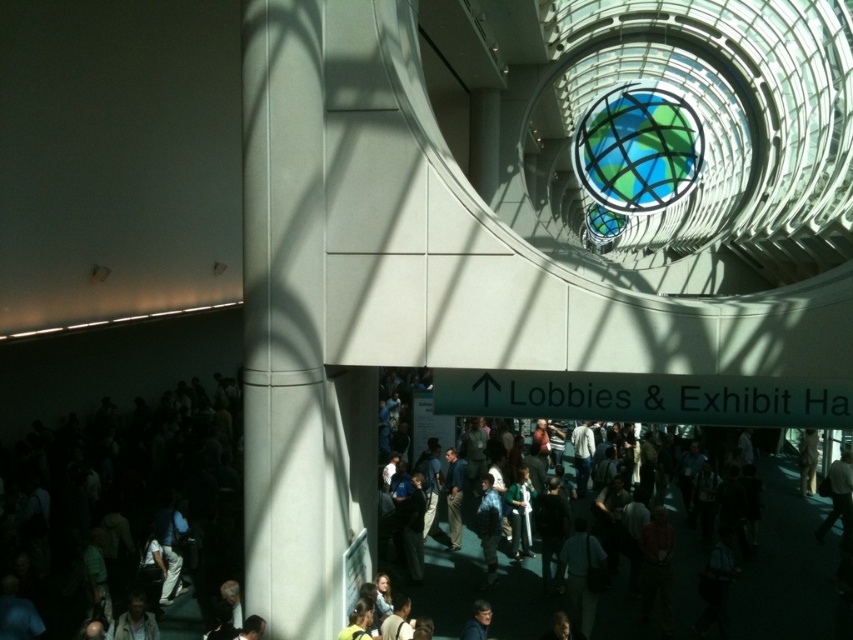
Is dark gray suit at lower left thinner than white smooth pillar at left?

Incorrect, dark gray suit at lower left's width is not less than white smooth pillar at left's.

Find the location of a particular element. The image size is (853, 640). dark gray suit at lower left is located at coordinates pos(126,506).

Is point (318, 422) closer to viewer compared to point (482, 493)?

Yes, it is.

Can you confirm if white smooth pillar at left is positioned to the left of dark gray textured jacket at center?

Correct, you'll find white smooth pillar at left to the left of dark gray textured jacket at center.

Who is more forward, [247,582] or [498,520]?

Positioned in front is point [247,582].

Identify the location of white smooth pillar at left. (285, 323).

Can you confirm if dark gray suit at lower left is thinner than dark gray textured jacket at center?

In fact, dark gray suit at lower left might be wider than dark gray textured jacket at center.

Does dark gray suit at lower left come in front of dark gray textured jacket at center?

Yes, dark gray suit at lower left is in front of dark gray textured jacket at center.

Does point (4, 476) come behind point (486, 480)?

Yes.

Where is `dark gray suit at lower left`? dark gray suit at lower left is located at coordinates [x=126, y=506].